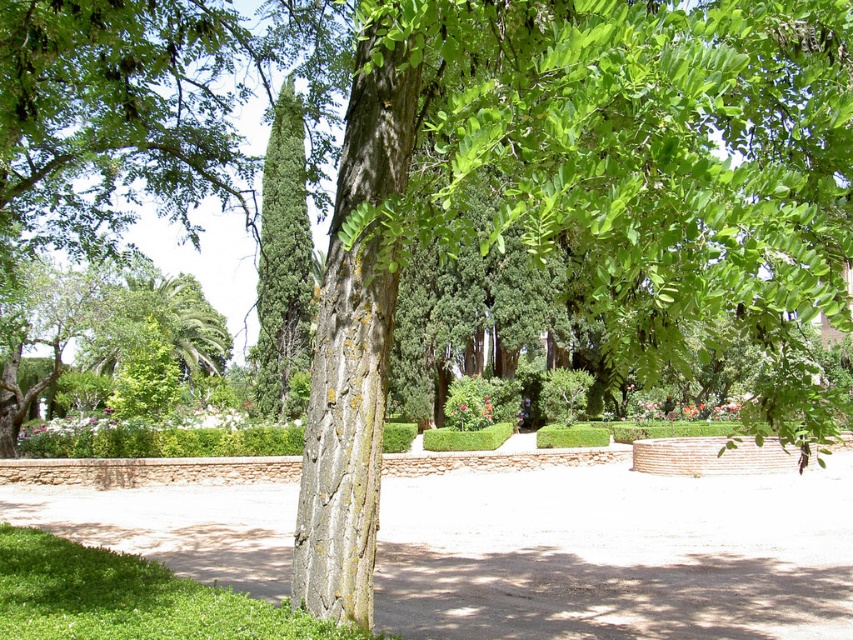
Question: Which point is closer to the camera?

Choices:
 (A) (379, 129)
 (B) (263, 301)

Answer: (A)

Question: Where is smooth bark tree trunk at center located in relation to green textured cypress at center in the image?

Choices:
 (A) left
 (B) right

Answer: (B)

Question: Which of the following is the closest to the observer?

Choices:
 (A) (347, 564)
 (B) (277, 216)

Answer: (A)

Question: Which object appears farthest from the camera in this image?

Choices:
 (A) green textured cypress at center
 (B) smooth bark tree trunk at center

Answer: (A)

Question: Is smooth bark tree trunk at center above green textured cypress at center?

Choices:
 (A) no
 (B) yes

Answer: (A)

Question: Is the position of smooth bark tree trunk at center more distant than that of green textured cypress at center?

Choices:
 (A) yes
 (B) no

Answer: (B)